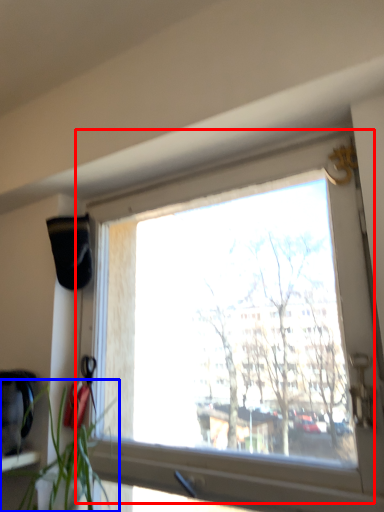
Question: Which of the following is the closest to the observer, window (highlighted by a red box) or houseplant (highlighted by a blue box)?

Choices:
 (A) window
 (B) houseplant

Answer: (B)